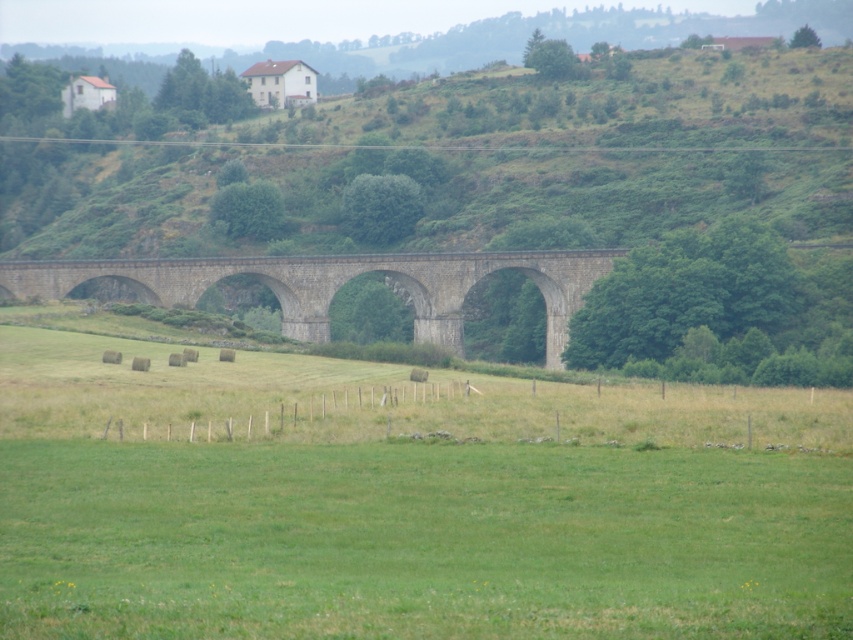
Question: Among these objects, which one is nearest to the camera?

Choices:
 (A) gray stone bridge at center
 (B) green grassy field at center

Answer: (B)

Question: Can you confirm if green grassy field at center is positioned to the left of gray stone bridge at center?

Choices:
 (A) no
 (B) yes

Answer: (A)

Question: Which of the following is the closest to the observer?

Choices:
 (A) green grassy field at center
 (B) gray stone bridge at center

Answer: (A)

Question: Which of the following is the closest to the observer?

Choices:
 (A) gray stone bridge at center
 (B) green grassy field at center

Answer: (B)

Question: Does green grassy field at center have a greater width compared to gray stone bridge at center?

Choices:
 (A) no
 (B) yes

Answer: (A)

Question: In this image, where is green grassy field at center located relative to gray stone bridge at center?

Choices:
 (A) above
 (B) below

Answer: (B)